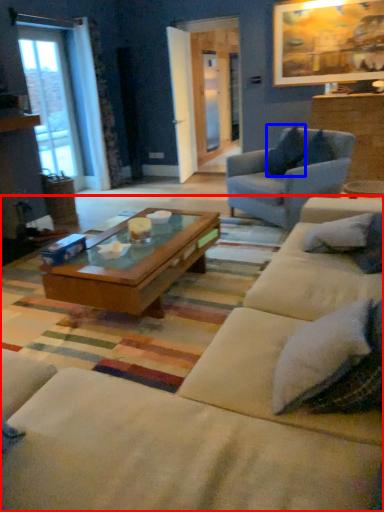
Question: Among these objects, which one is nearest to the camera, studio couch (highlighted by a red box) or pillow (highlighted by a blue box)?

Choices:
 (A) studio couch
 (B) pillow

Answer: (A)